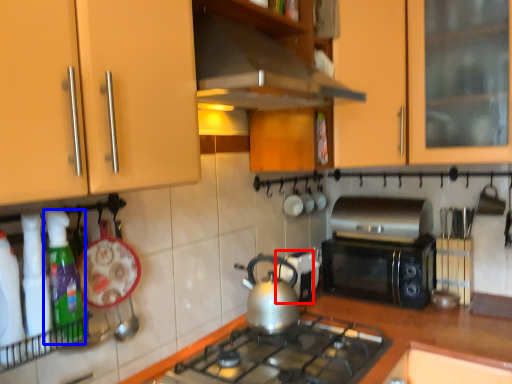
Question: Among these objects, which one is farthest to the camera, appliance (highlighted by a red box) or kitchen appliance (highlighted by a blue box)?

Choices:
 (A) appliance
 (B) kitchen appliance

Answer: (A)